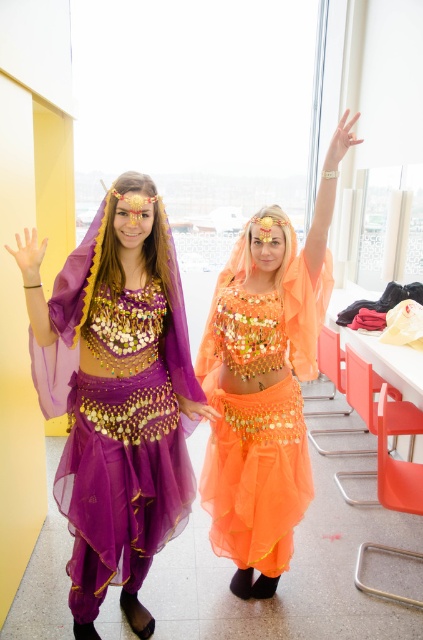
Question: Does matte purple fabric at left appear under orange sheer fabric belly dancer at center?

Choices:
 (A) no
 (B) yes

Answer: (B)

Question: Is matte purple fabric at left closer to camera compared to orange sheer fabric belly dancer at center?

Choices:
 (A) yes
 (B) no

Answer: (B)

Question: Among these objects, which one is farthest from the camera?

Choices:
 (A) orange sheer fabric belly dancer at center
 (B) matte purple fabric at left

Answer: (B)

Question: Can you confirm if matte purple fabric at left is positioned to the right of orange sheer fabric belly dancer at center?

Choices:
 (A) yes
 (B) no

Answer: (B)

Question: Which object appears closest to the camera in this image?

Choices:
 (A) matte purple fabric at left
 (B) orange sheer fabric belly dancer at center

Answer: (B)

Question: Which point is farther to the camera?

Choices:
 (A) pos(301,346)
 (B) pos(148,177)

Answer: (A)